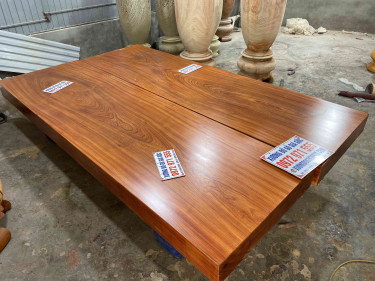
The image size is (375, 281). I want to click on table, so click(x=157, y=81).